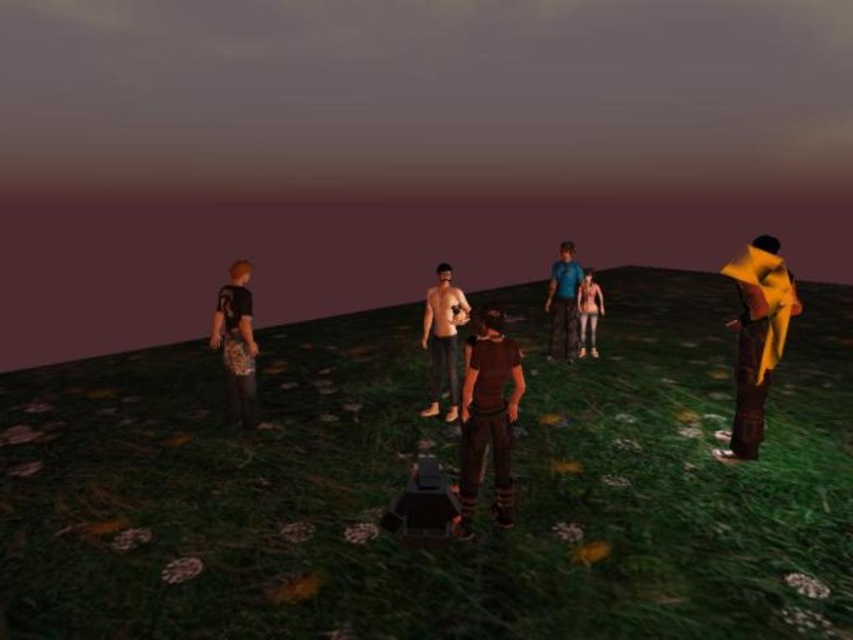
Can you confirm if smooth skin torso at center is positioned to the right of blue fabric shirt at center?

Incorrect, smooth skin torso at center is not on the right side of blue fabric shirt at center.

Does smooth skin torso at center appear under blue fabric shirt at center?

Yes.

Identify the location of smooth skin torso at center. (444, 339).

Does smooth skin torso at center appear over leather jacket at center?

Incorrect, smooth skin torso at center is not positioned above leather jacket at center.

Where is `smooth skin torso at center`? Image resolution: width=853 pixels, height=640 pixels. smooth skin torso at center is located at coordinates (444, 339).

You are a GUI agent. You are given a task and a screenshot of the screen. Output one action in this format:
    pyautogui.click(x=<x>, y=<y>)
    Task: Click on the smooth skin torso at center
    This screenshot has width=853, height=640.
    Given the screenshot: What is the action you would take?
    pyautogui.click(x=444, y=339)

From the picture: Who is higher up, green grassy field at center or smooth skin torso at center?

smooth skin torso at center

Between green grassy field at center and smooth skin torso at center, which one has more height?

smooth skin torso at center is taller.

What do you see at coordinates (450, 472) in the screenshot? I see `green grassy field at center` at bounding box center [450, 472].

In order to click on green grassy field at center in this screenshot , I will do `click(450, 472)`.